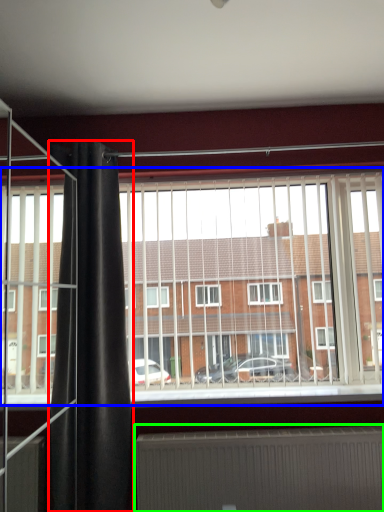
Question: Which object is positioned farthest from shower curtain (highlighted by a red box)? Select from window (highlighted by a blue box) and radiator (highlighted by a green box).

Choices:
 (A) window
 (B) radiator

Answer: (B)